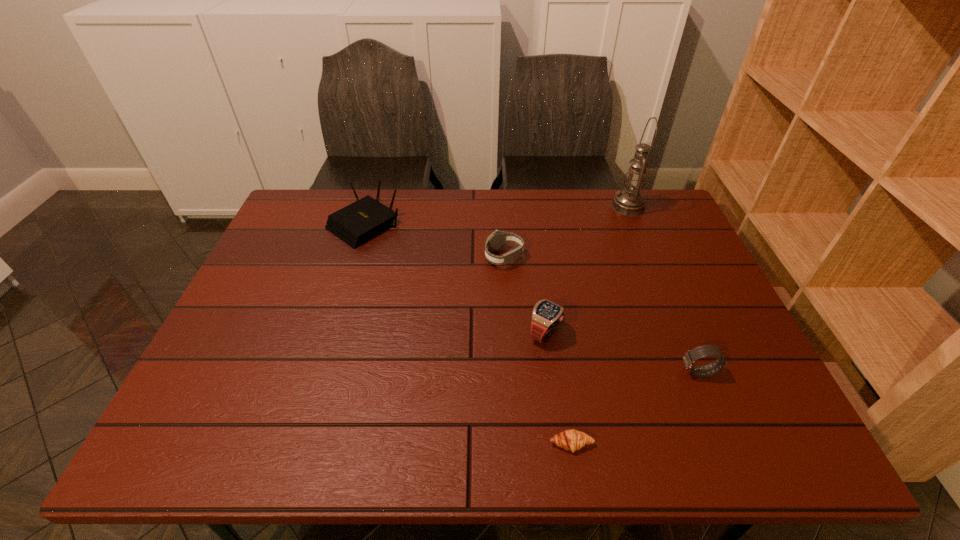
I want to click on oil lamp, so click(x=629, y=202).

Locate an element on the screen. router is located at coordinates (361, 221).

Where is `the fourth farthest object`? the fourth farthest object is located at coordinates (546, 315).

Where is `the second nearest object`? the second nearest object is located at coordinates (689, 358).

Locate an element on the screen. This screenshot has width=960, height=540. the nearest watch is located at coordinates pyautogui.click(x=689, y=358).

Identify the location of the farthest watch. The image size is (960, 540). (496, 240).

This screenshot has width=960, height=540. Identify the location of pastry. 572,440.

Find the location of a particular element. This screenshot has height=540, width=960. the nearest object is located at coordinates (572, 440).

Where is `vacant space located 0.240m on the left of the tallest object`? vacant space located 0.240m on the left of the tallest object is located at coordinates (540, 207).

This screenshot has width=960, height=540. Find the location of `vacant position located on the right of the router`. vacant position located on the right of the router is located at coordinates (501, 225).